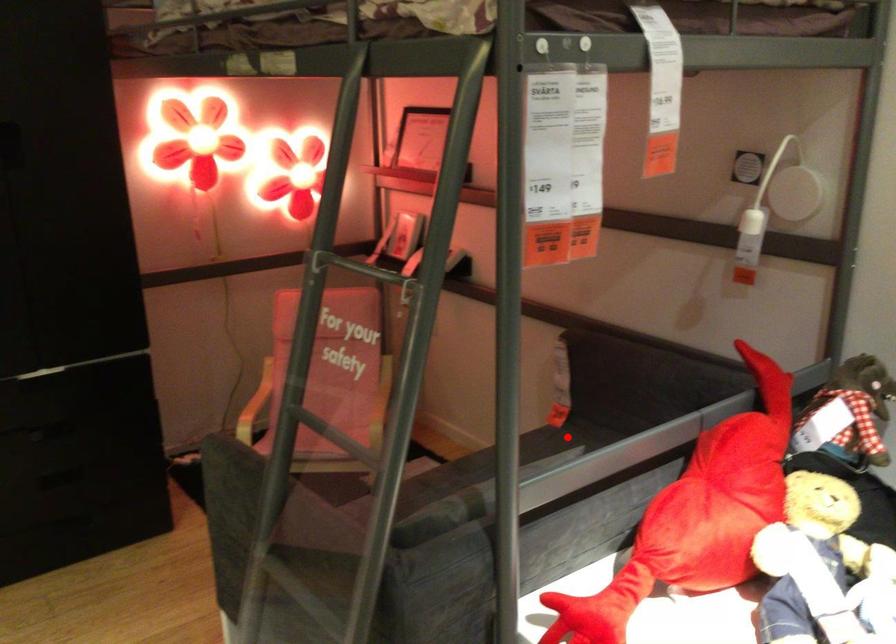
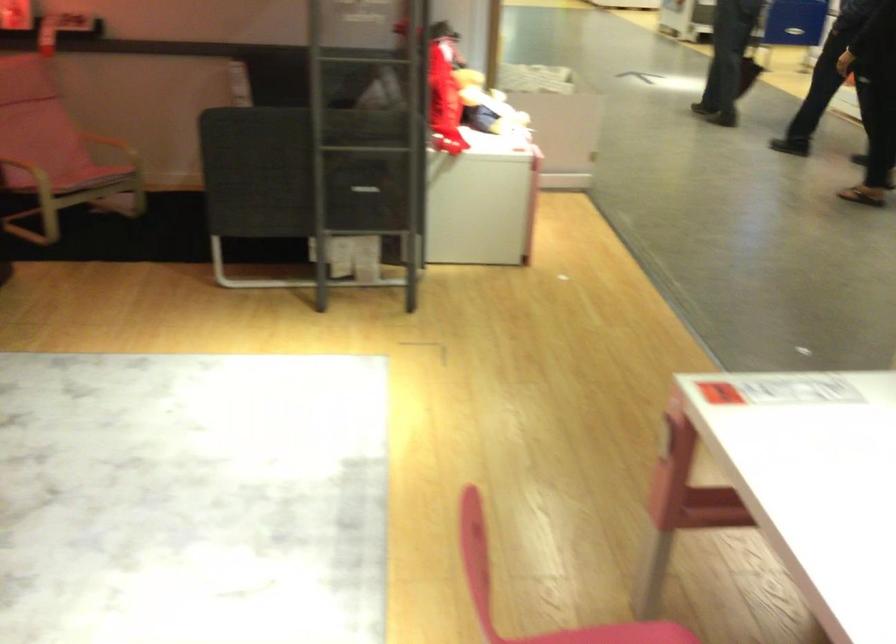
Question: I am providing you with two images of the same scene from different viewpoints. A red point is marked on the first image. At the location where the point appears in image 1, is it still visible in image 2?

Choices:
 (A) Yes
 (B) No

Answer: (B)